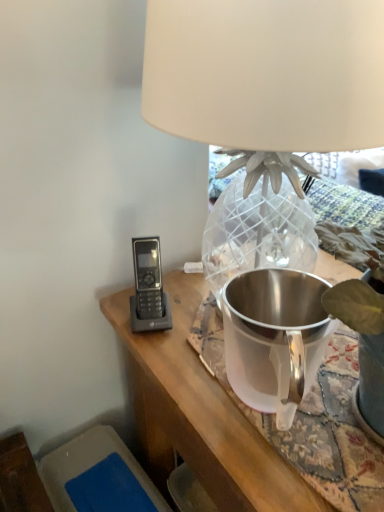
Question: From a real-world perspective, is satin silver pitcher at center located beneath matte white lampshade at upper center?

Choices:
 (A) no
 (B) yes

Answer: (B)

Question: Considering the relative sizes of satin silver pitcher at center and matte white lampshade at upper center in the image provided, is satin silver pitcher at center shorter than matte white lampshade at upper center?

Choices:
 (A) no
 (B) yes

Answer: (B)

Question: Is satin silver pitcher at center wider than matte white lampshade at upper center?

Choices:
 (A) no
 (B) yes

Answer: (A)

Question: Is satin silver pitcher at center oriented away from matte white lampshade at upper center?

Choices:
 (A) yes
 (B) no

Answer: (A)

Question: Considering the relative sizes of satin silver pitcher at center and matte white lampshade at upper center in the image provided, is satin silver pitcher at center bigger than matte white lampshade at upper center?

Choices:
 (A) no
 (B) yes

Answer: (A)

Question: Does satin silver pitcher at center have a greater height compared to matte white lampshade at upper center?

Choices:
 (A) yes
 (B) no

Answer: (B)

Question: Is matte white lampshade at upper center oriented away from satin silver pitcher at center?

Choices:
 (A) no
 (B) yes

Answer: (A)

Question: From the image's perspective, would you say matte white lampshade at upper center is shown under satin silver pitcher at center?

Choices:
 (A) yes
 (B) no

Answer: (B)

Question: Considering the relative sizes of matte white lampshade at upper center and satin silver pitcher at center in the image provided, is matte white lampshade at upper center shorter than satin silver pitcher at center?

Choices:
 (A) no
 (B) yes

Answer: (A)

Question: From a real-world perspective, is matte white lampshade at upper center under satin silver pitcher at center?

Choices:
 (A) yes
 (B) no

Answer: (B)

Question: Is matte white lampshade at upper center to the left of satin silver pitcher at center from the viewer's perspective?

Choices:
 (A) yes
 (B) no

Answer: (B)

Question: Does matte white lampshade at upper center have a lesser width compared to satin silver pitcher at center?

Choices:
 (A) yes
 (B) no

Answer: (B)

Question: Is point (273, 106) closer or farther from the camera than point (306, 318)?

Choices:
 (A) farther
 (B) closer

Answer: (B)